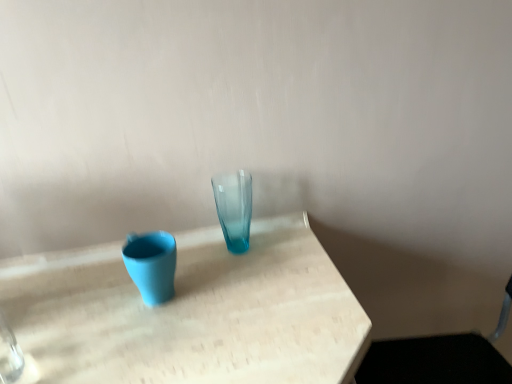
Question: From the image's perspective, is translucent glass vase at center, the 1th vase in the right-to-left sequence, above or below metallic silver swivel chair at lower right?

Choices:
 (A) above
 (B) below

Answer: (A)

Question: Is translucent glass vase at center, marked as the 2th vase in a left-to-right arrangement, taller or shorter than metallic silver swivel chair at lower right?

Choices:
 (A) short
 (B) tall

Answer: (A)

Question: Based on their relative distances, which object is nearer to the matte blue vase at left, the 2th vase viewed from the right?

Choices:
 (A) translucent glass vase at center, the 1th vase in the right-to-left sequence
 (B) metallic silver swivel chair at lower right

Answer: (A)

Question: Which is nearer to the matte blue vase at left, the 1th vase from the left?

Choices:
 (A) metallic silver swivel chair at lower right
 (B) translucent glass vase at center, marked as the 2th vase in a left-to-right arrangement

Answer: (B)